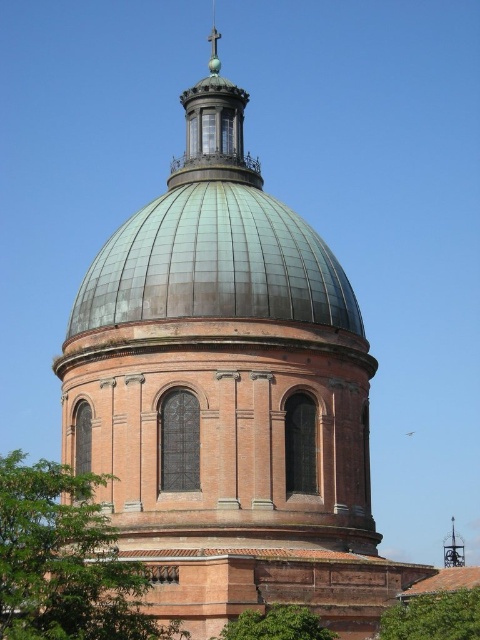
You are standing at the center of the dome. Looking towards the lower left, you see a green leafy tree. Where is the point at coordinate (x=66, y=561) located in relation to the tree?

The point at coordinate (x=66, y=561) is located on the green leafy tree at lower left.

You are standing in front of the dome and want to take a photo that includes both the green leafy tree at lower left and the green leafy tree at lower right. Which tree should you position closer to the center of your camera frame to ensure both are visible?

You should position the green leafy tree at lower left closer to the center of your camera frame because it is under the green leafy tree at lower right, so moving it towards the center will help both trees fit within the frame.